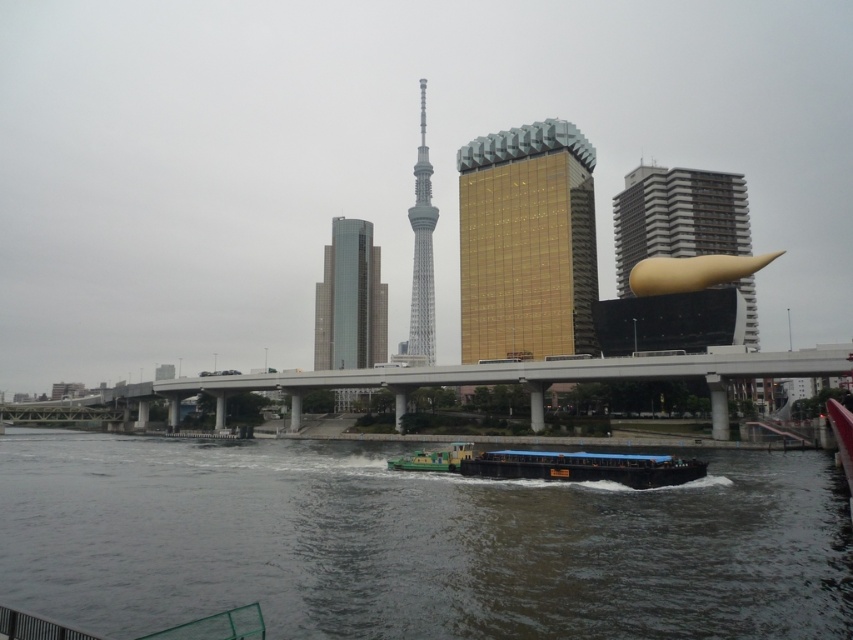
Question: From the image, what is the correct spatial relationship of dark gray water at center in relation to glassy gray skyscraper at center?

Choices:
 (A) right
 (B) left

Answer: (A)

Question: Which point appears farthest from the camera in this image?

Choices:
 (A) (361, 609)
 (B) (445, 451)
 (C) (498, 291)
 (D) (701, 188)

Answer: (C)

Question: Does gold metallic sculpture at right appear under sleek silver tower at center?

Choices:
 (A) no
 (B) yes

Answer: (B)

Question: Estimate the real-world distances between objects in this image. Which object is closer to the gold glass building at center?

Choices:
 (A) dark gray water at center
 (B) gold metallic sculpture at right
 (C) dark blue wooden barge at center

Answer: (B)

Question: Does gold metallic sculpture at right have a smaller size compared to glassy gray skyscraper at center?

Choices:
 (A) no
 (B) yes

Answer: (B)

Question: Which object is positioned closest to the gold glass building at center?

Choices:
 (A) dark gray water at center
 (B) gold metallic sculpture at right
 (C) sleek silver tower at center

Answer: (B)